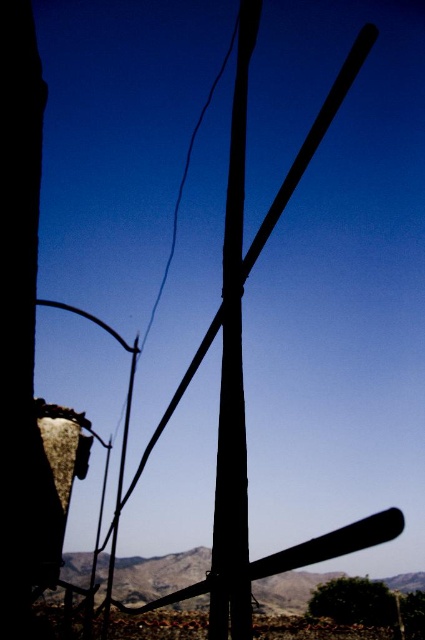
You are a surveyor trying to determine the position of the smooth wood pole at center relative to the structure. Based on the coordinates provided in the Objects Description, can you confirm if the pole is positioned at the exact center of the structure?

The smooth wood pole at center is located at point coordinates of (232, 380), which is not exactly at the center of the structure. The exact center would be at coordinates (212, 320), so the pole is slightly to the right and above the true center.

You are a surveyor measuring distances between landmarks in the scene. You need to determine if the distance between the smooth wood pole at center and the green leafy tree at lower center is more than 12 meters. What do you observe?

The smooth wood pole at center and the green leafy tree at lower center are 12.49 meters apart, which is just over 12 meters. Therefore, the distance is more than 12 meters.

You are standing in front of the structure and want to determine the relative positions of two points marked on the structure. The points are labeled as point 1 at coordinates point (226, 342) and point 2 at coordinates point (350, 580). Which point is closer to your viewpoint?

Point 1 at coordinates point (226, 342) is closer to the camera than point 2 at coordinates point (350, 580), so point 1 is closer to your viewpoint.